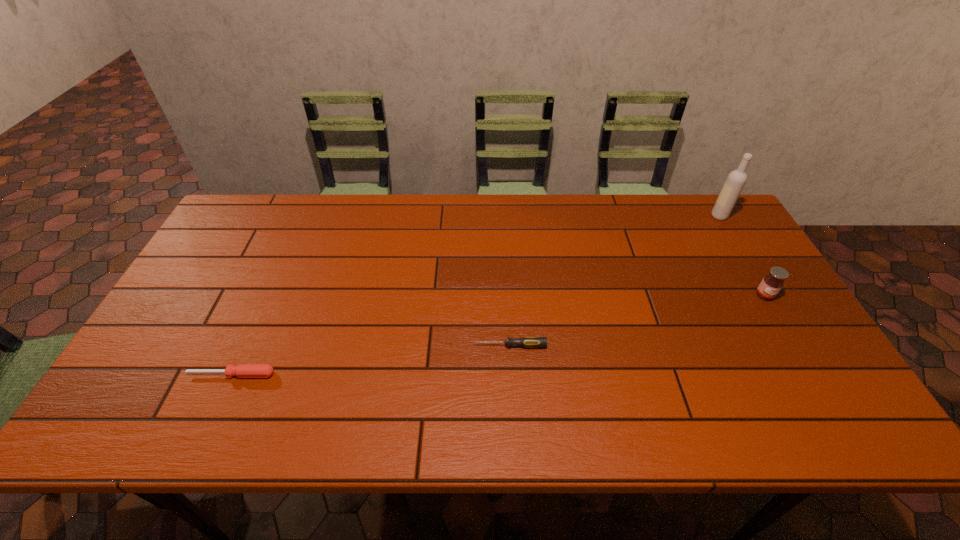
At what (x,y) coordinates should I click in order to perform the action: click on vacant space situated 0.090m on the left of the nearer screwdriver. Please return your answer as a coordinate pair (x, y). The image size is (960, 540). Looking at the image, I should click on (151, 374).

Locate an element on the screen. The image size is (960, 540). vacant region located insert the third farthest object into a screw head is located at coordinates (417, 345).

Locate an element on the screen. The width and height of the screenshot is (960, 540). vacant position located insert the third farthest object into a screw head is located at coordinates (322, 345).

You are a GUI agent. You are given a task and a screenshot of the screen. Output one action in this format:
    pyautogui.click(x=<x>, y=<y>)
    Task: Click on the free region located 0.350m insert the third farthest object into a screw head
    This screenshot has width=960, height=540.
    Given the screenshot: What is the action you would take?
    pyautogui.click(x=334, y=345)

You are a GUI agent. You are given a task and a screenshot of the screen. Output one action in this format:
    pyautogui.click(x=<x>, y=<y>)
    Task: Click on the object that is at the far edge
    
    Given the screenshot: What is the action you would take?
    pyautogui.click(x=736, y=180)

I want to click on object that is at the left edge, so click(242, 370).

At what (x,y) coordinates should I click in order to perform the action: click on vodka present at the right edge. Please return your answer as a coordinate pair (x, y). Image resolution: width=960 pixels, height=540 pixels. Looking at the image, I should click on (736, 180).

The image size is (960, 540). Find the location of `jam situated at the right edge`. jam situated at the right edge is located at coordinates (772, 283).

At what (x,y) coordinates should I click in order to perform the action: click on object situated at the far right corner. Please return your answer as a coordinate pair (x, y). This screenshot has height=540, width=960. Looking at the image, I should click on (736, 180).

In order to click on free space at the far edge in this screenshot , I will do `click(428, 210)`.